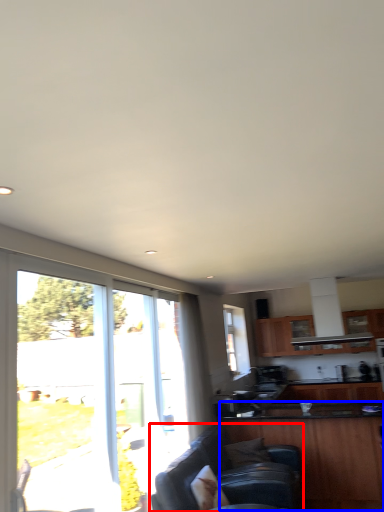
Question: Among these objects, which one is nearest to the camera, studio couch (highlighted by a red box) or cabinetry (highlighted by a blue box)?

Choices:
 (A) studio couch
 (B) cabinetry

Answer: (A)